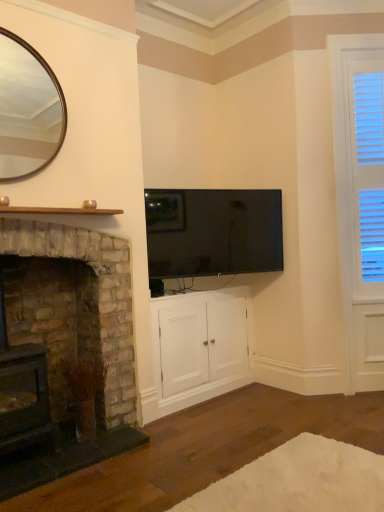
Question: Considering the positions of white wood cabinet at center and rustic stone fireplace at left, acting as the second fireplace starting from the right, in the image, is white wood cabinet at center wider or thinner than rustic stone fireplace at left, acting as the second fireplace starting from the right,?

Choices:
 (A) wide
 (B) thin

Answer: (B)

Question: From a real-world perspective, is white wood cabinet at center physically located above or below rustic stone fireplace at left, the first fireplace in the left-to-right sequence?

Choices:
 (A) below
 (B) above

Answer: (A)

Question: Based on their relative distances, which object is nearer to the rustic stone fireplace at left, the first fireplace in the left-to-right sequence?

Choices:
 (A) flat-screen black tv at upper center
 (B) black plastic phone at lower center
 (C) white wood blinds at right
 (D) gold-framed mirror at upper left
 (E) rustic stone fireplace at left, the 1th fireplace positioned from the right

Answer: (E)

Question: Based on their relative distances, which object is farther from the black plastic phone at lower center?

Choices:
 (A) rustic stone fireplace at left, the first fireplace in the left-to-right sequence
 (B) white wood cabinet at center
 (C) rustic stone fireplace at left, which is counted as the 2th fireplace, starting from the left
 (D) white fluffy rug at lower center
 (E) flat-screen black tv at upper center

Answer: (D)